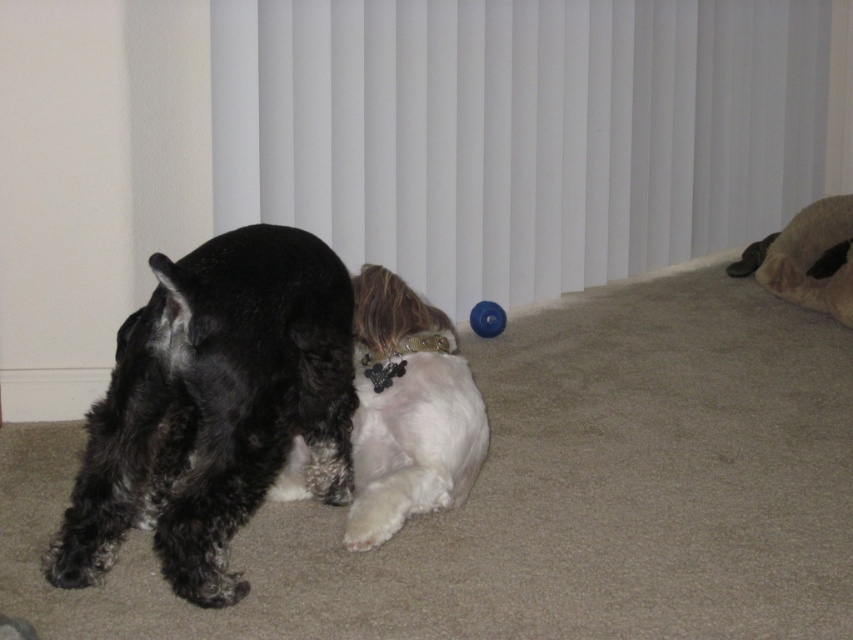
Question: Which of the following is the closest to the observer?

Choices:
 (A) (459, 209)
 (B) (489, 320)
 (C) (167, 259)
 (D) (370, 300)

Answer: (C)

Question: Estimate the real-world distances between objects in this image. Which object is farther from the white fluffy dog at center?

Choices:
 (A) shiny black fur at left
 (B) blue rubber ball at center
 (C) white plastic blinds at upper center

Answer: (C)

Question: Which object is closer to the camera taking this photo?

Choices:
 (A) shiny black fur at left
 (B) white fluffy dog at center
 (C) blue rubber ball at center
 (D) white plastic blinds at upper center

Answer: (A)

Question: Where is white fluffy dog at center located in relation to blue rubber ball at center in the image?

Choices:
 (A) left
 (B) right

Answer: (A)

Question: Does white plastic blinds at upper center have a lesser width compared to white fluffy dog at center?

Choices:
 (A) yes
 (B) no

Answer: (B)

Question: Is shiny black fur at left positioned behind white fluffy dog at center?

Choices:
 (A) yes
 (B) no

Answer: (B)